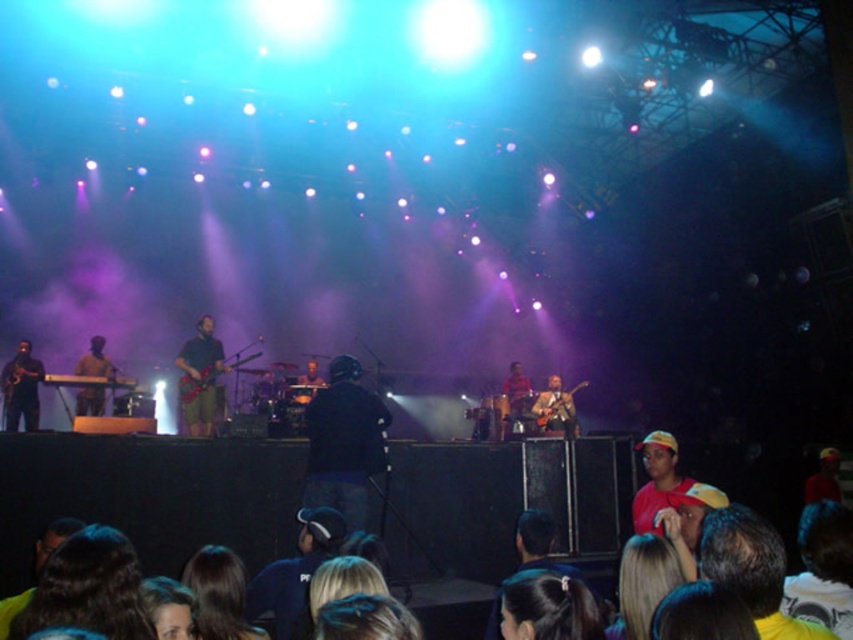
Who is more distant from viewer, (584, 595) or (207, 401)?

The point (207, 401) is behind.

Find the location of a particular element. dark brown hair at lower center is located at coordinates (547, 608).

From the picture: Does shiny black saxophone at left have a greater height compared to wooden acoustic guitar at center?

Indeed, shiny black saxophone at left has a greater height compared to wooden acoustic guitar at center.

Can you confirm if shiny black saxophone at left is positioned to the left of wooden acoustic guitar at center?

Correct, you'll find shiny black saxophone at left to the left of wooden acoustic guitar at center.

Between point (35, 404) and point (543, 417), which one is positioned in front?

Point (35, 404)

Identify the location of shiny black saxophone at left. This screenshot has width=853, height=640. (21, 388).

What do you see at coordinates (200, 380) in the screenshot?
I see `shiny red guitar at center` at bounding box center [200, 380].

Does shiny red guitar at center have a larger size compared to matte black keyboard at left?

Indeed, shiny red guitar at center has a larger size compared to matte black keyboard at left.

Does point (204, 342) come in front of point (68, 381)?

No, it is not.

Where is `shiny red guitar at center`? shiny red guitar at center is located at coordinates (200, 380).